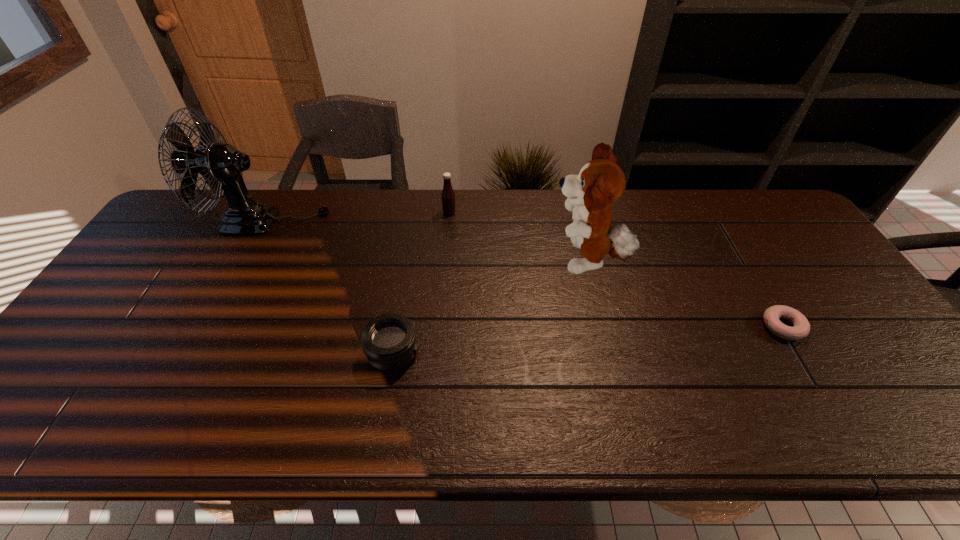
Identify the location of the leftmost object. (221, 165).

Where is `puppy`? This screenshot has height=540, width=960. puppy is located at coordinates (600, 182).

I want to click on Tabasco sauce, so click(448, 197).

You are a GUI agent. You are given a task and a screenshot of the screen. Output one action in this format:
    pyautogui.click(x=<x>, y=<y>)
    Task: Click on the third object from left to right
    
    Given the screenshot: What is the action you would take?
    pyautogui.click(x=448, y=197)

The width and height of the screenshot is (960, 540). I want to click on telephoto lens, so click(x=389, y=340).

At what (x,y) coordinates should I click in order to perform the action: click on the fourth tallest object. Please return your answer as a coordinate pair (x, y). The image size is (960, 540). Looking at the image, I should click on (389, 340).

Identify the location of doughnut. [x=801, y=327].

Identify the location of the shortest object. (801, 327).

Where is `free space located in front of the fan, indicating the direction of air flow`? The width and height of the screenshot is (960, 540). free space located in front of the fan, indicating the direction of air flow is located at coordinates point(412,221).

Find the location of a particular element. vacant space located on the face of the fourth object from left to right is located at coordinates (415, 262).